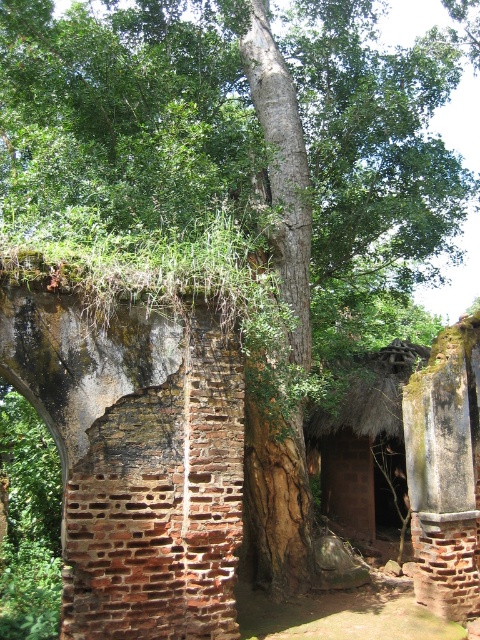
Which is behind, point (123, 592) or point (361, 468)?

Positioned behind is point (361, 468).

Which is behind, point (130, 428) or point (400, 460)?

The point (400, 460) is more distant.

The width and height of the screenshot is (480, 640). What are the coordinates of `rusty brick wall at center` in the screenshot? It's located at (134, 456).